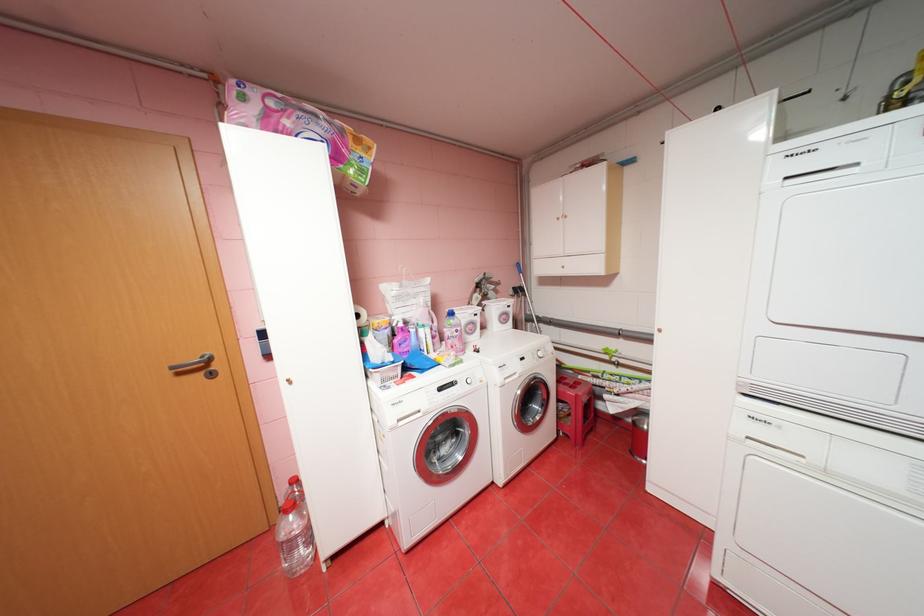
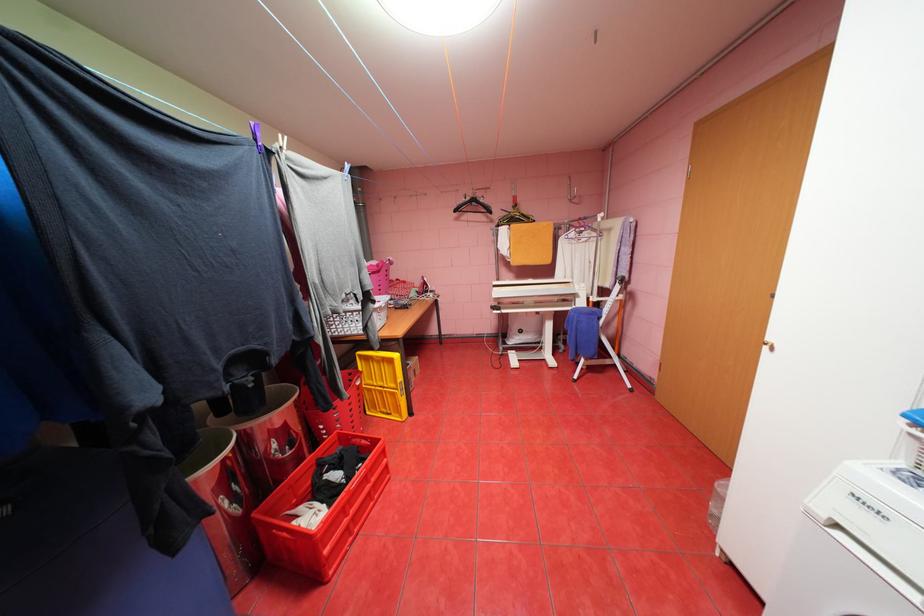
The point at (407, 421) is marked in the first image. Where is the corresponding point in the second image?

(845, 525)